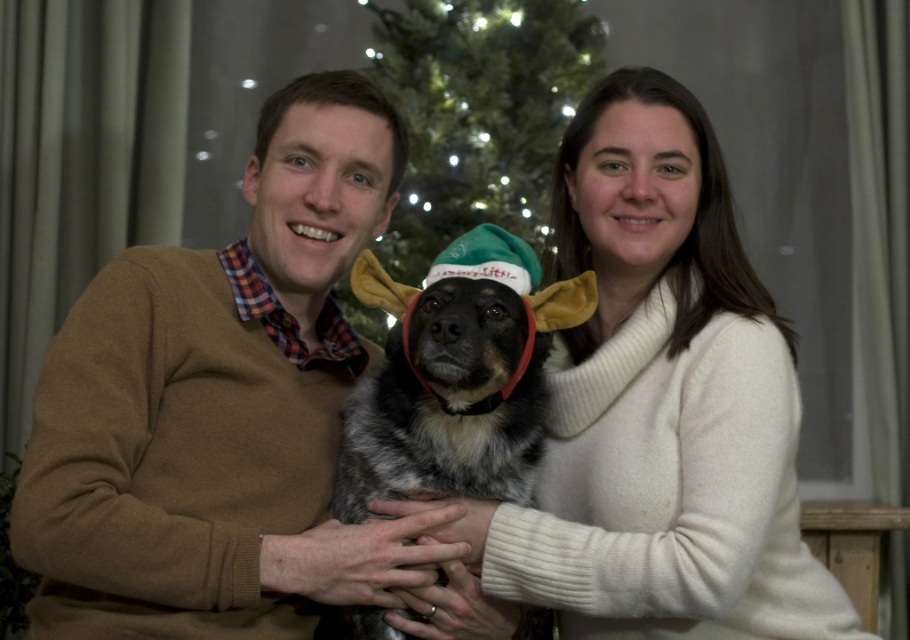
In the scene shown: You are taking a photo of the brown sweater at center and the speckled fur dog at center. Which object is positioned higher in the image?

The brown sweater at center is located above the speckled fur dog at center, so it is positioned higher in the image.

You are standing in front of the Christmas tree and want to take a photo. You have two points marked as reference points for your camera focus. The first point is at coordinates point (110, 509) and the second is at point (512, 458). Which point should you focus on to ensure the foreground subject is sharp?

You should focus on point (110, 509) because it is closer to the camera than point (512, 458), ensuring the foreground subject is in focus.

In the scene shown: You are a photographer standing in front of the subjects. You want to take a picture of both the brown sweater at center and the white woolen sweater at center. Can you fit both of them in your camera frame if your camera has a minimum required distance of 12 inches between the subjects to capture them clearly?

Yes, the distance between the brown sweater at center and the white woolen sweater at center is 13.08 inches, which is greater than the camera frame requirement of 12 inches. Both sweaters can be captured clearly.